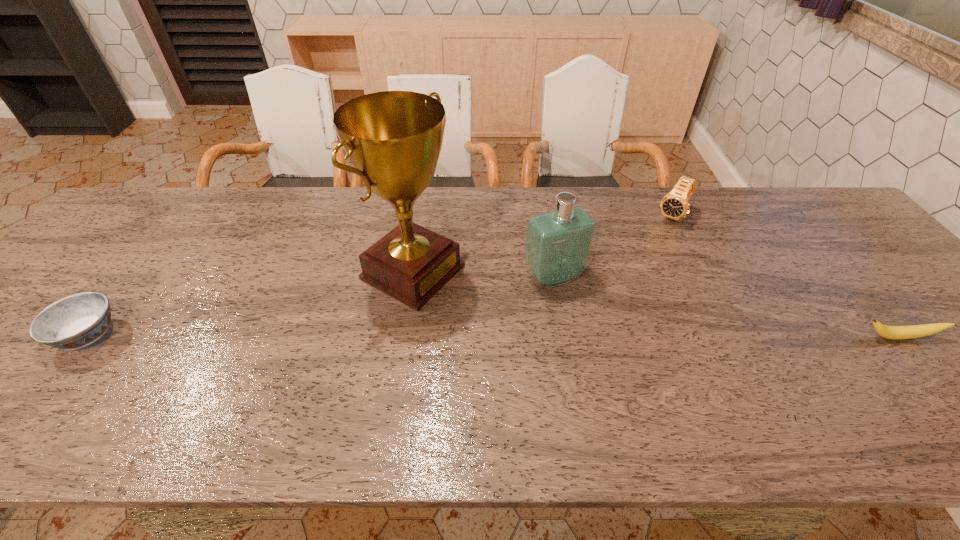
Identify the location of empty location between the banana and the leftmost object. (493, 336).

This screenshot has height=540, width=960. In order to click on free space between the rightmost object and the tallest object in this screenshot , I will do `click(656, 305)`.

The image size is (960, 540). I want to click on vacant space that is in between the farthest object and the rightmost object, so click(x=785, y=276).

Locate which object ranks in proximity to the banana. Please provide its 2D coordinates. Your answer should be formatted as a tuple, i.e. [(x, y)], where the tuple contains the x and y coordinates of a point satisfying the conditions above.

[(674, 205)]

Identify which object is located as the nearest to the fourth object from left to right. Please provide its 2D coordinates. Your answer should be formatted as a tuple, i.e. [(x, y)], where the tuple contains the x and y coordinates of a point satisfying the conditions above.

[(558, 243)]

Identify the location of vacant space that satisfies the following two spatial constraints: 1. on the back side of the perfume; 2. on the right side of the farthest object. This screenshot has height=540, width=960. (543, 216).

You are a GUI agent. You are given a task and a screenshot of the screen. Output one action in this format:
    pyautogui.click(x=<x>, y=<y>)
    Task: Click on the free spot that satisfies the following two spatial constraints: 1. on the back side of the perfume; 2. on the left side of the fourth object from left to right
    The height and width of the screenshot is (540, 960).
    Given the screenshot: What is the action you would take?
    pyautogui.click(x=543, y=216)

This screenshot has height=540, width=960. I want to click on free space that satisfies the following two spatial constraints: 1. on the back side of the award; 2. on the left side of the ashtray, so click(136, 272).